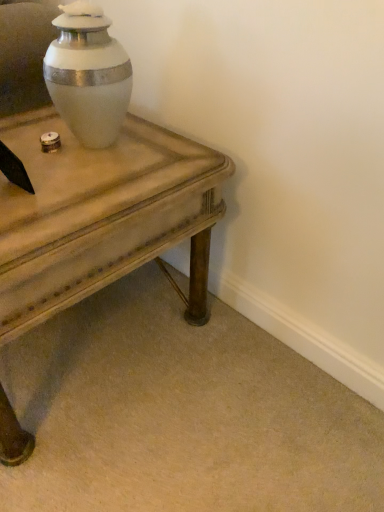
Locate an element on the screen. This screenshot has width=384, height=512. vacant space in front of white glossy urn at upper center is located at coordinates (91, 178).